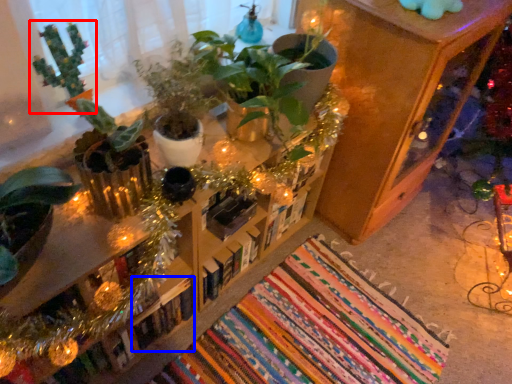
Question: Which point is further to the camera, houseplant (highlighted by a red box) or book (highlighted by a blue box)?

Choices:
 (A) houseplant
 (B) book

Answer: (B)